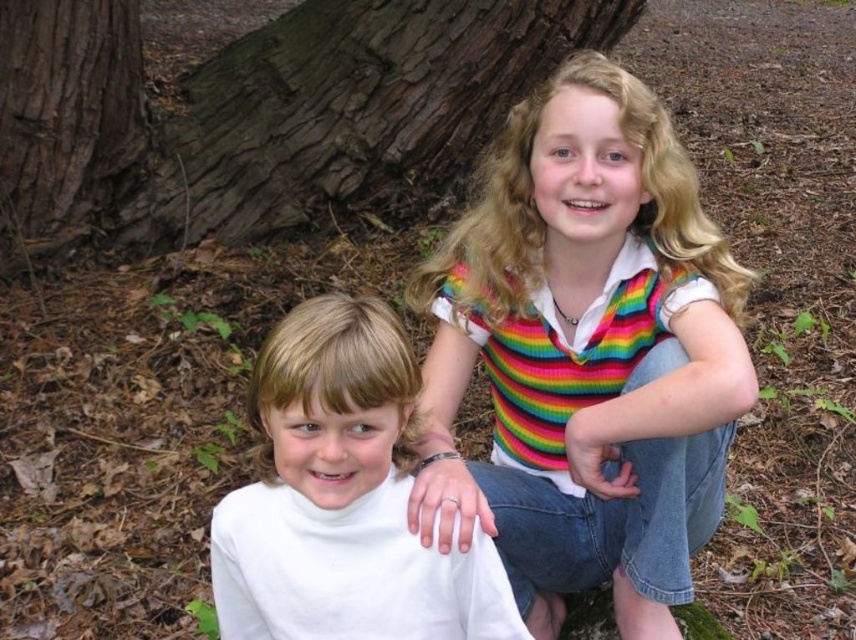
You are a photographer trying to capture the rainbow knitted sweater at center and the brown rough tree trunk at left in a single shot. Based on their positions, which object should be placed lower in the frame?

The rainbow knitted sweater at center should be placed lower in the frame because it is located below the brown rough tree trunk at left.

You are a photographer trying to capture the rainbow knitted sweater at center and the brown rough tree trunk at left in a single shot. Which object will appear larger in the photo?

The rainbow knitted sweater at center is taller than the brown rough tree trunk at left, so it will appear larger in the photo.